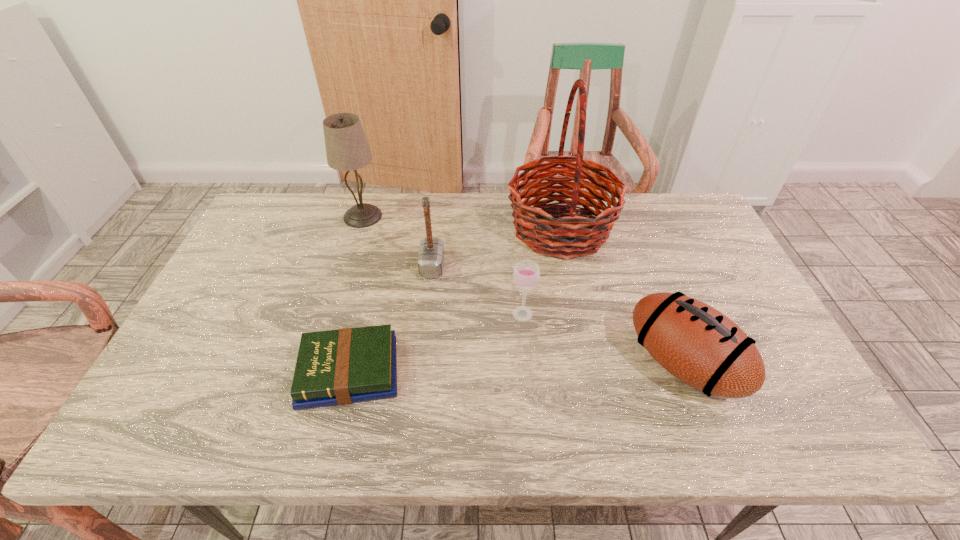
This screenshot has width=960, height=540. In order to click on the tallest object in this screenshot , I will do `click(572, 235)`.

Where is `lampshade`? lampshade is located at coordinates (347, 149).

Identify the location of the fourth object from right to left. (431, 253).

I want to click on hammer, so click(431, 253).

I want to click on football (American), so click(x=699, y=345).

Locate an element on the screen. The height and width of the screenshot is (540, 960). wineglass is located at coordinates (526, 274).

Locate an element on the screen. This screenshot has height=540, width=960. the shortest object is located at coordinates (336, 367).

At what (x,y) coordinates should I click in order to perform the action: click on vacant space located 0.160m on the handle side of the basket. Please return your answer as a coordinate pair (x, y). This screenshot has height=540, width=960. Looking at the image, I should click on (456, 230).

This screenshot has width=960, height=540. Identify the location of free location located 0.080m on the handle side of the basket. (480, 230).

Locate an element on the screen. free spot located on the handle side of the basket is located at coordinates (389, 230).